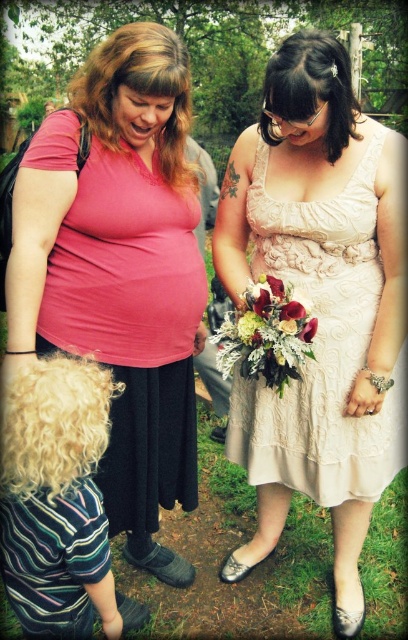
Question: Among these points, which one is farthest from the camera?

Choices:
 (A) (263, 394)
 (B) (270, 285)

Answer: (A)

Question: Which object appears farthest from the camera in this image?

Choices:
 (A) white silk bouquet at center
 (B) silvery metallic bouquet at center

Answer: (A)

Question: Does striped cotton shirt at lower left appear on the right side of rustic floral bouquet at center?

Choices:
 (A) yes
 (B) no

Answer: (B)

Question: Does ivory lace dress at center appear over striped cotton shirt at lower left?

Choices:
 (A) no
 (B) yes

Answer: (B)

Question: Which of the following is the closest to the observer?

Choices:
 (A) (235, 326)
 (B) (250, 324)

Answer: (B)

Question: Where is velvety red rose at center located in relation to silvery metallic bouquet at center in the image?

Choices:
 (A) below
 (B) above

Answer: (B)